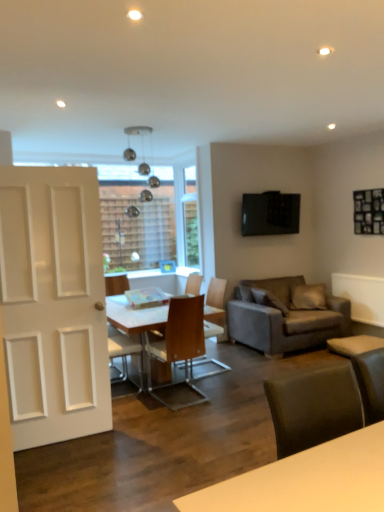
Question: Which direction should I rotate to face light brown wooden chair at center, placed as the second chair when sorted from front to back, — up or down?

Choices:
 (A) up
 (B) down

Answer: (B)

Question: Considering the relative sizes of wooden chair at center, arranged as the first chair when viewed from the front, and white matte door at left in the image provided, is wooden chair at center, arranged as the first chair when viewed from the front, taller than white matte door at left?

Choices:
 (A) no
 (B) yes

Answer: (A)

Question: Is wooden chair at center, the fourth chair in the back-to-front sequence, thinner than white matte door at left?

Choices:
 (A) yes
 (B) no

Answer: (B)

Question: Is wooden chair at center, the fourth chair in the back-to-front sequence, turned away from white matte door at left?

Choices:
 (A) yes
 (B) no

Answer: (B)

Question: Are wooden chair at center, arranged as the first chair when viewed from the front, and white matte door at left far apart?

Choices:
 (A) no
 (B) yes

Answer: (A)

Question: Is wooden chair at center, the fourth chair in the back-to-front sequence, smaller than white matte door at left?

Choices:
 (A) yes
 (B) no

Answer: (A)

Question: Does wooden chair at center, arranged as the first chair when viewed from the front, appear on the left side of white matte door at left?

Choices:
 (A) yes
 (B) no

Answer: (B)

Question: Could you tell me if white glossy table at center is facing wooden chair at center, positioned as the 2th chair in back-to-front order?

Choices:
 (A) no
 (B) yes

Answer: (A)

Question: Is white glossy table at center wider than wooden chair at center, marked as the 3th chair in a front-to-back arrangement?

Choices:
 (A) no
 (B) yes

Answer: (B)

Question: Would you say white glossy table at center is outside wooden chair at center, marked as the 3th chair in a front-to-back arrangement?

Choices:
 (A) no
 (B) yes

Answer: (B)

Question: Does white glossy table at center have a greater height compared to wooden chair at center, positioned as the 2th chair in back-to-front order?

Choices:
 (A) no
 (B) yes

Answer: (A)

Question: Considering the relative positions of white glossy table at center and wooden chair at center, positioned as the 2th chair in back-to-front order, in the image provided, is white glossy table at center to the right of wooden chair at center, positioned as the 2th chair in back-to-front order, from the viewer's perspective?

Choices:
 (A) yes
 (B) no

Answer: (B)

Question: From the image's perspective, is white glossy table at center below wooden chair at center, positioned as the 2th chair in back-to-front order?

Choices:
 (A) no
 (B) yes

Answer: (B)

Question: Can you confirm if wooden chair at center, which ranks as the fourth chair in front-to-back order, is positioned to the right of light brown wooden chair at center, placed as the second chair when sorted from front to back?

Choices:
 (A) yes
 (B) no

Answer: (A)